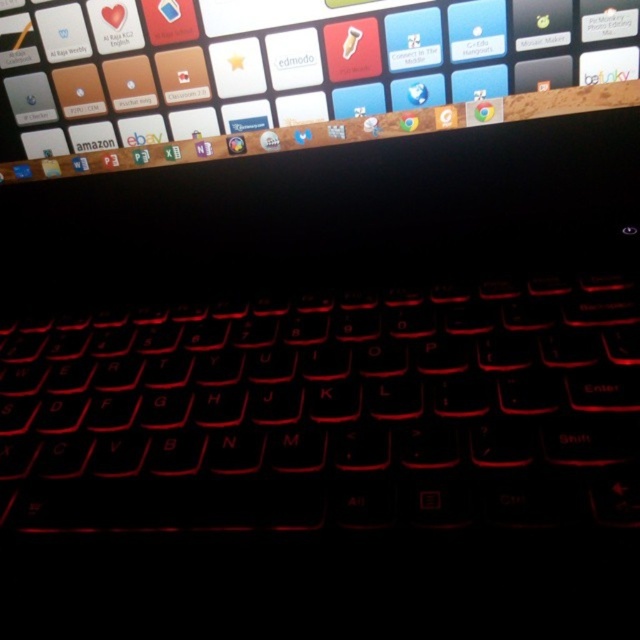
Who is more forward, (x=173, y=486) or (x=163, y=108)?

Point (x=173, y=486) is in front.

Is point (504, 304) in front of point (300, 19)?

Yes, it is.

Is point (388, 483) positioned before point (508, 32)?

Yes.

Locate an element on the screen. Image resolution: width=640 pixels, height=640 pixels. black matte keyboard at center is located at coordinates (326, 410).